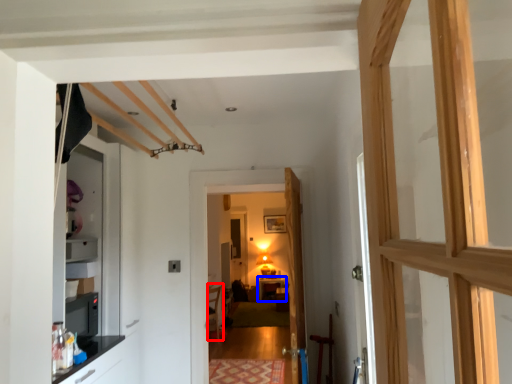
Question: Which object appears closest to the camera in this image, furniture (highlighted by a red box) or table (highlighted by a blue box)?

Choices:
 (A) furniture
 (B) table

Answer: (A)